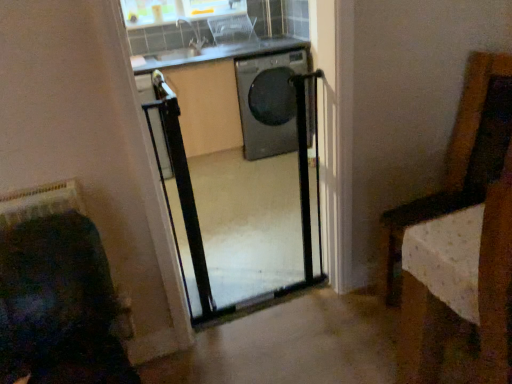
Find the location of a particular element. transparent plastic window at upper center is located at coordinates (177, 11).

What are the coordinates of `clear plastic basket at upper center` in the screenshot? It's located at (232, 29).

Describe the element at coordinates (232, 29) in the screenshot. The height and width of the screenshot is (384, 512). I see `clear plastic basket at upper center` at that location.

Where is `black metal screen door at center`? black metal screen door at center is located at coordinates (245, 189).

From the image's perspective, which is below, transparent plastic window at upper center or black metal screen door at center?

black metal screen door at center appears lower in the image.

How distant is transparent plastic window at upper center from black metal screen door at center?

4.26 feet.

You are a GUI agent. You are given a task and a screenshot of the screen. Output one action in this format:
    pyautogui.click(x=<x>, y=<y>)
    Task: Click on the screen door below the transparent plastic window at upper center (from the image's perspective)
    The image size is (512, 384).
    Given the screenshot: What is the action you would take?
    pyautogui.click(x=245, y=189)

Is transparent plastic window at upper center turned away from black metal screen door at center?

No, black metal screen door at center is not at the back of transparent plastic window at upper center.

Which object is further away from the camera taking this photo, black metal screen door at center or transparent plastic window at upper center?

transparent plastic window at upper center.

Are black metal screen door at center and transparent plastic window at upper center far apart?

Yes, black metal screen door at center and transparent plastic window at upper center are quite far apart.

Can you confirm if black metal screen door at center is thinner than transparent plastic window at upper center?

Correct, the width of black metal screen door at center is less than that of transparent plastic window at upper center.

Is black metal screen door at center facing away from transparent plastic window at upper center?

No, black metal screen door at center is not facing away from transparent plastic window at upper center.

Can you confirm if black glossy washing machine at center is taller than black metal screen door at center?

In fact, black glossy washing machine at center may be shorter than black metal screen door at center.

This screenshot has height=384, width=512. I want to click on washing machine above the black metal screen door at center (from the image's perspective), so click(x=253, y=117).

From the image's perspective, relative to black metal screen door at center, is black glossy washing machine at center above or below?

Based on their image positions, black glossy washing machine at center is located above black metal screen door at center.

Which is more to the left, clear plastic basket at upper center or transparent plastic window at upper center?

From the viewer's perspective, transparent plastic window at upper center appears more on the left side.

Would you say clear plastic basket at upper center is outside transparent plastic window at upper center?

Yes, clear plastic basket at upper center is outside of transparent plastic window at upper center.

Who is more distant, clear plastic basket at upper center or transparent plastic window at upper center?

transparent plastic window at upper center is further away from the camera.

Which of these two, transparent plastic window at upper center or clear plastic basket at upper center, is bigger?

clear plastic basket at upper center.

Based on the photo, from a real-world perspective, is transparent plastic window at upper center on top of clear plastic basket at upper center?

Yes, from a real-world perspective, transparent plastic window at upper center is over clear plastic basket at upper center

Consider the image. In the image, is transparent plastic window at upper center on the left side or the right side of clear plastic basket at upper center?

transparent plastic window at upper center is to the left of clear plastic basket at upper center.

Is clear plastic basket at upper center located within transparent plastic window at upper center?

That's incorrect, clear plastic basket at upper center is not inside transparent plastic window at upper center.

Can you confirm if black metal screen door at center is bigger than clear plastic basket at upper center?

Yes, black metal screen door at center is bigger than clear plastic basket at upper center.

How many degrees apart are the facing directions of black metal screen door at center and clear plastic basket at upper center?

The angle between the facing direction of black metal screen door at center and the facing direction of clear plastic basket at upper center is 179 degrees.

Which of these two, black metal screen door at center or clear plastic basket at upper center, stands shorter?

Standing shorter between the two is clear plastic basket at upper center.

Is black metal screen door at center outside of clear plastic basket at upper center?

black metal screen door at center is positioned outside clear plastic basket at upper center.

The width and height of the screenshot is (512, 384). I want to click on window above the black glossy washing machine at center (from the image's perspective), so click(x=177, y=11).

Based on the photo, is black glossy washing machine at center behind transparent plastic window at upper center?

No, black glossy washing machine at center is closer to the camera.

From a real-world perspective, relative to transparent plastic window at upper center, is black glossy washing machine at center vertically above or below?

black glossy washing machine at center is below transparent plastic window at upper center.

I want to click on window that is behind the black metal screen door at center, so click(177, 11).

Locate an element on the screen. Image resolution: width=512 pixels, height=384 pixels. window above the black metal screen door at center (from the image's perspective) is located at coordinates (177, 11).

Considering their positions, is transparent plastic window at upper center positioned closer to clear plastic basket at upper center than black glossy washing machine at center?

Based on the image, transparent plastic window at upper center appears to be nearer to clear plastic basket at upper center.

Looking at the image, which one is located further to black glossy washing machine at center, transparent plastic window at upper center or clear plastic basket at upper center?

transparent plastic window at upper center.

Estimate the real-world distances between objects in this image. Which object is further from black metal screen door at center, black glossy washing machine at center or transparent plastic window at upper center?

Among the two, transparent plastic window at upper center is located further to black metal screen door at center.

Which object lies nearer to the anchor point black glossy washing machine at center, clear plastic basket at upper center or transparent plastic window at upper center?

The object closer to black glossy washing machine at center is clear plastic basket at upper center.

From the image, which object appears to be nearer to black metal screen door at center, clear plastic basket at upper center or black glossy washing machine at center?

The object closer to black metal screen door at center is black glossy washing machine at center.

Looking at the image, which one is located closer to black metal screen door at center, black glossy washing machine at center or clear plastic basket at upper center?

black glossy washing machine at center is closer to black metal screen door at center.

From the image, which object appears to be nearer to transparent plastic window at upper center, black metal screen door at center or black glossy washing machine at center?

Among the two, black glossy washing machine at center is located nearer to transparent plastic window at upper center.

Looking at the image, which one is located closer to clear plastic basket at upper center, black glossy washing machine at center or black metal screen door at center?

black glossy washing machine at center is closer to clear plastic basket at upper center.

This screenshot has width=512, height=384. In order to click on washing machine positioned between black metal screen door at center and clear plastic basket at upper center from near to far in this screenshot , I will do `click(253, 117)`.

Image resolution: width=512 pixels, height=384 pixels. What are the coordinates of `washing machine between black metal screen door at center and transparent plastic window at upper center in the front-back direction` in the screenshot? It's located at (253, 117).

Where is `armchair that lies between transparent plastic window at upper center and black glossy washing machine at center from top to bottom`? The image size is (512, 384). armchair that lies between transparent plastic window at upper center and black glossy washing machine at center from top to bottom is located at coordinates (232, 29).

Find the location of a particular element. armchair positioned between black metal screen door at center and transparent plastic window at upper center from near to far is located at coordinates (232, 29).